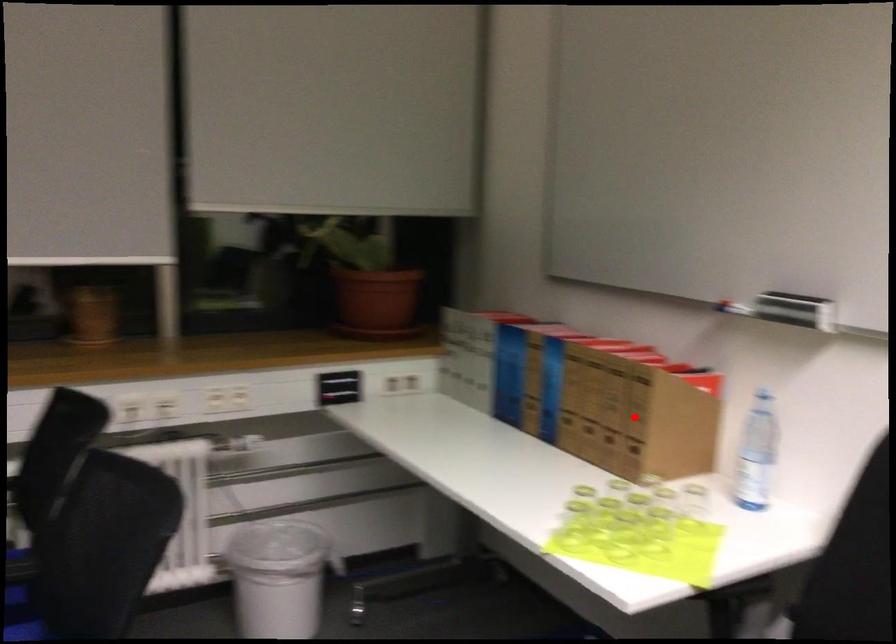
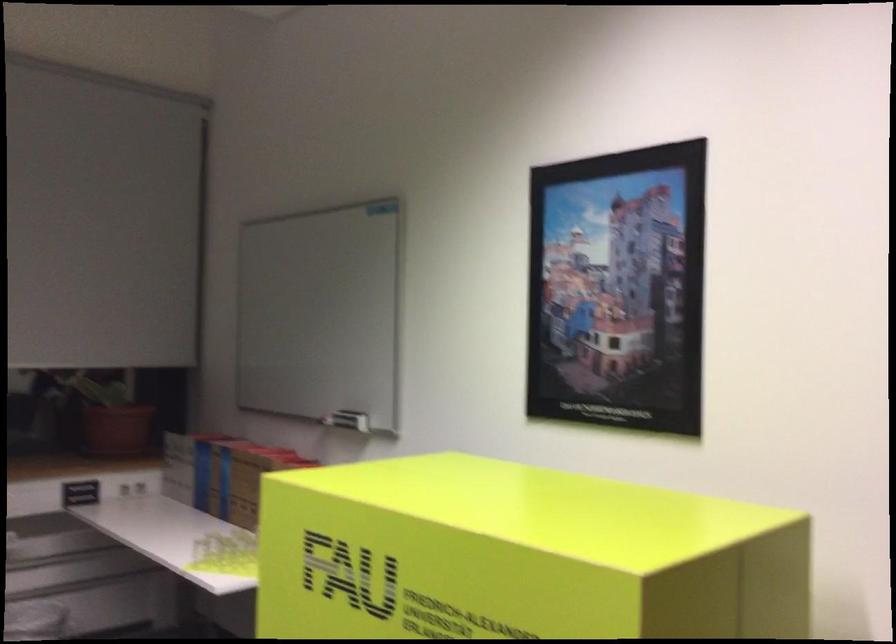
Question: I am providing you with two images of the same scene from different viewpoints. A red point is marked on the first image. Is the red point's position out of view in image 2?

Choices:
 (A) Yes
 (B) No

Answer: (A)